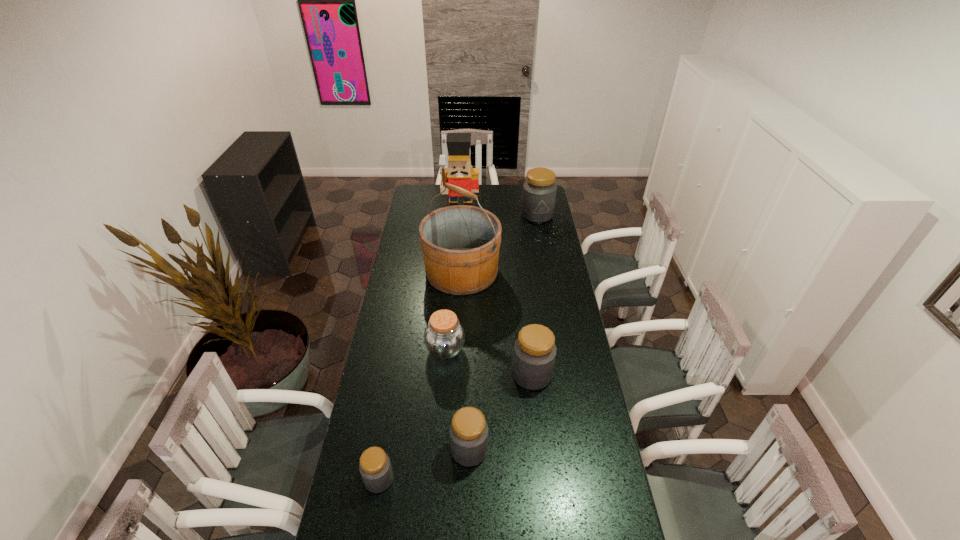
The height and width of the screenshot is (540, 960). I want to click on red nutcracker, so click(x=459, y=172).

What are the coordinates of `bucket` in the screenshot? It's located at coord(460,244).

The width and height of the screenshot is (960, 540). Identify the location of the tallest jar. (539, 191).

The height and width of the screenshot is (540, 960). I want to click on the biggest gray jar, so click(539, 191).

Where is `the third nearest gray jar`? This screenshot has height=540, width=960. the third nearest gray jar is located at coordinates (534, 355).

Locate an element on the screen. This screenshot has width=960, height=540. the fourth shortest object is located at coordinates tap(534, 355).

Where is `brown jar`? The width and height of the screenshot is (960, 540). brown jar is located at coordinates (444, 336).

You are a GUI agent. You are given a task and a screenshot of the screen. Output one action in this format:
    pyautogui.click(x=<x>, y=<y>)
    Task: Click on the second gray jar from left to right
    The height and width of the screenshot is (540, 960).
    Given the screenshot: What is the action you would take?
    pyautogui.click(x=469, y=432)

Locate an element on the screen. Image resolution: width=960 pixels, height=540 pixels. the shortest object is located at coordinates (375, 468).

This screenshot has width=960, height=540. Identify the location of the leftmost jar. (375, 468).